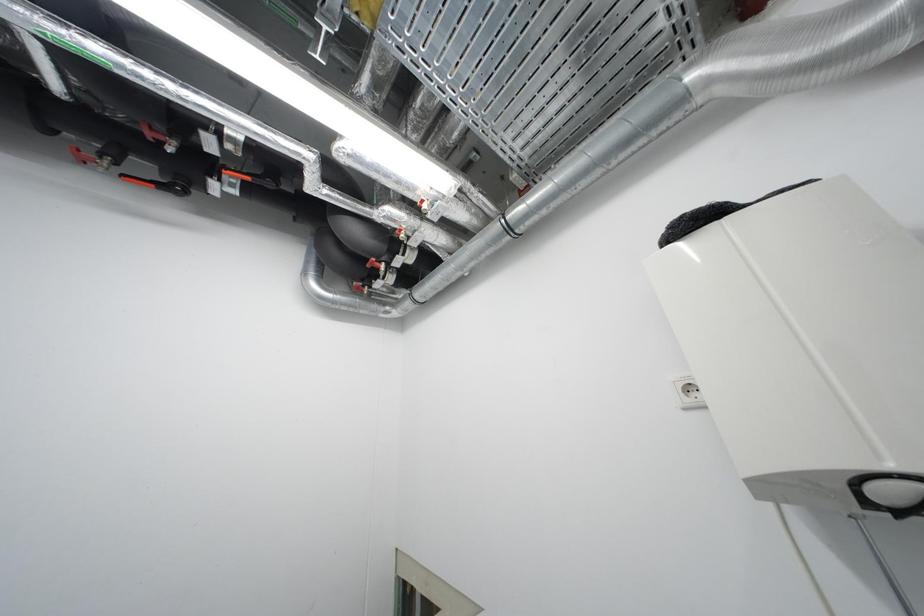
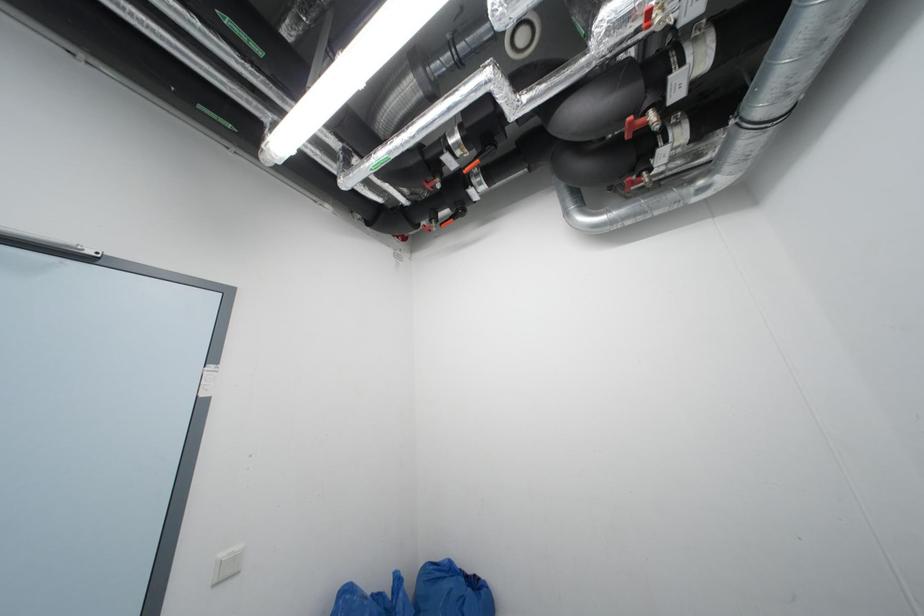
Question: The camera is either moving clockwise (left) or counter-clockwise (right) around the object. The first image is from the beginning of the video and the second image is from the end. Is the camera moving left or right when shooting the video?

Choices:
 (A) Left
 (B) Right

Answer: (B)